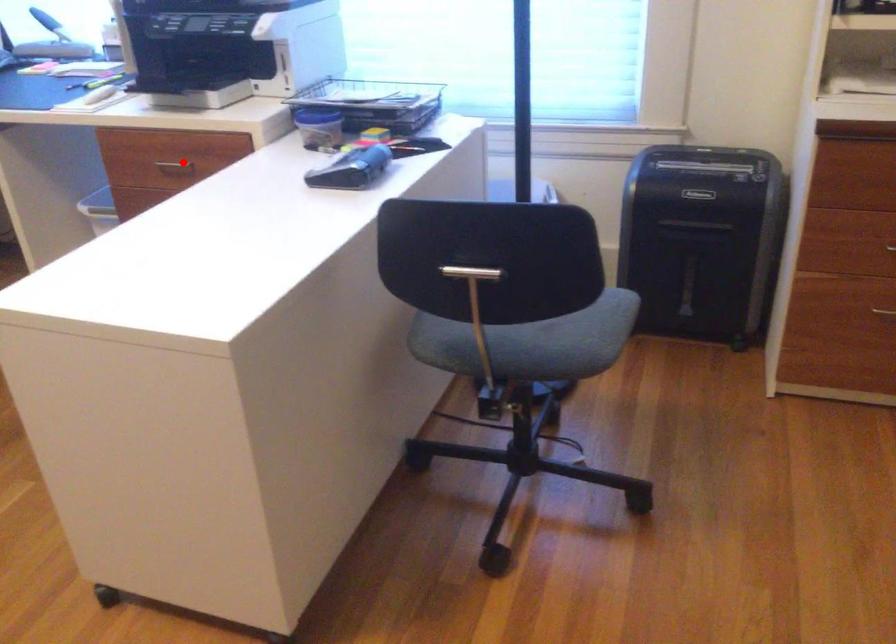
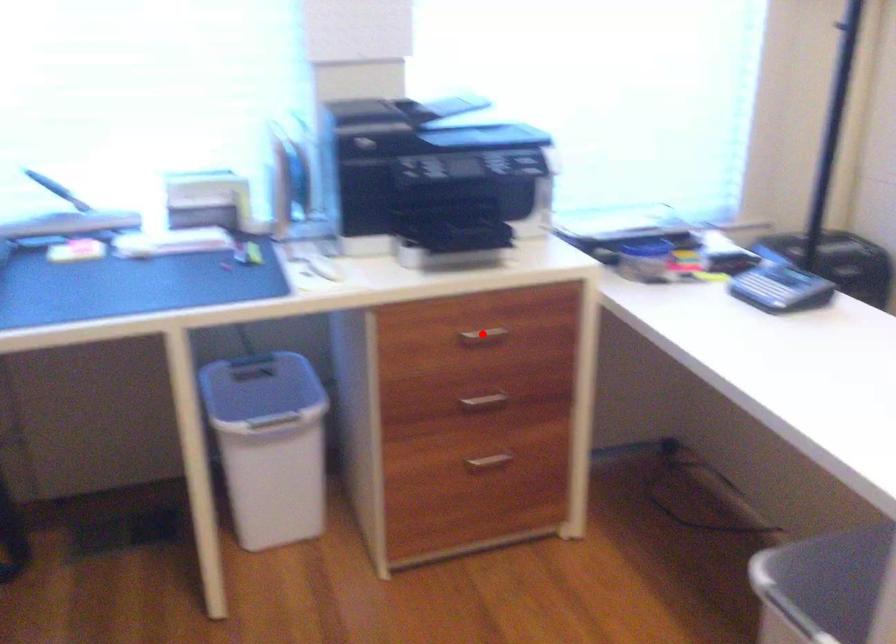
I am providing you with two images of the same scene from different viewpoints. A red point is marked on the first image and another point is marked on the second image. Is the red point in image1 aligned with the point shown in image2?

Yes